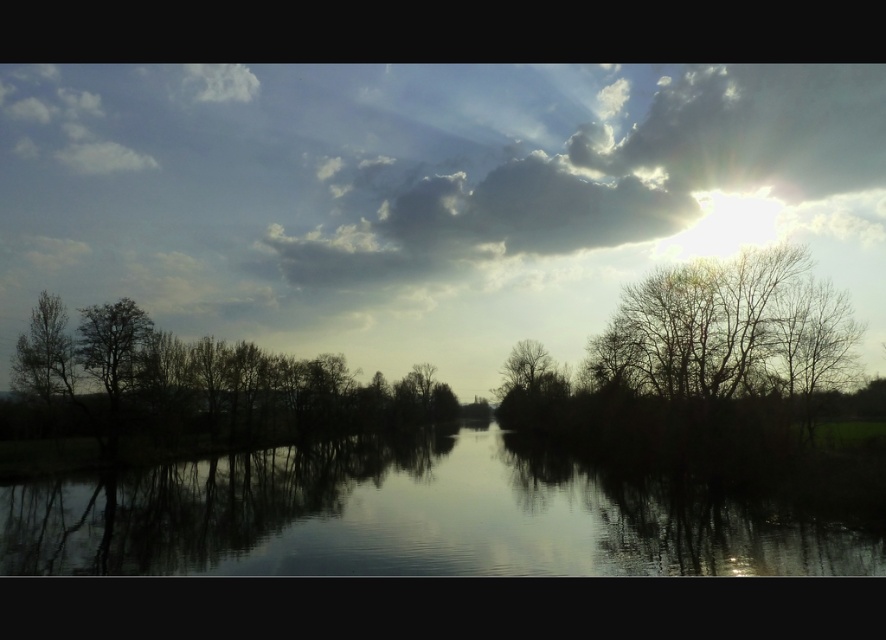
Is silvery reflective water at center thinner than cloudy sky at upper center?

Yes, silvery reflective water at center is thinner than cloudy sky at upper center.

Can you confirm if silvery reflective water at center is positioned to the right of cloudy sky at upper center?

Incorrect, silvery reflective water at center is not on the right side of cloudy sky at upper center.

Is point (400, 545) farther from camera compared to point (714, 145)?

No.

Identify the location of silvery reflective water at center. (406, 516).

Does point (479, 180) come closer to viewer compared to point (352, 380)?

No, (479, 180) is behind (352, 380).

Find the location of a particular element. cloudy sky at upper center is located at coordinates (601, 173).

Is cloudy sky at upper center to the left of green matte tree at left from the viewer's perspective?

Incorrect, cloudy sky at upper center is not on the left side of green matte tree at left.

Based on the photo, does cloudy sky at upper center appear over green matte tree at left?

Indeed, cloudy sky at upper center is positioned over green matte tree at left.

Is point (387, 166) positioned in front of point (20, 346)?

No, it is behind (20, 346).

Find the location of `cloudy sky at upper center`. cloudy sky at upper center is located at coordinates (601, 173).